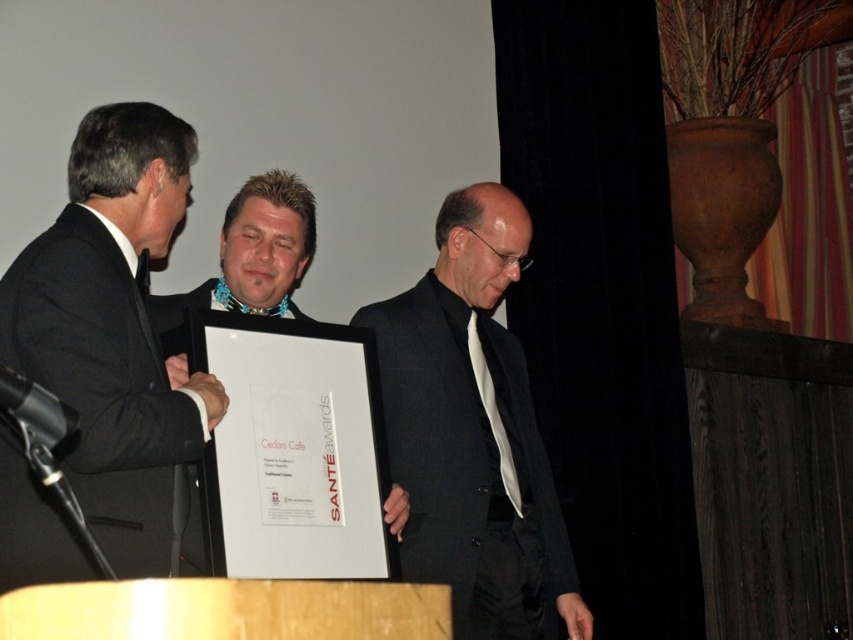
Question: Based on their relative distances, which object is farther from the matte black suit at center?

Choices:
 (A) matte black frame at center
 (B) black suit at left

Answer: (B)

Question: In this image, where is black suit at left located relative to matte black frame at center?

Choices:
 (A) above
 (B) below

Answer: (B)

Question: Which object is positioned farthest from the matte black frame at center?

Choices:
 (A) matte black suit at center
 (B) black suit at left

Answer: (A)

Question: Is matte black suit at center to the right of matte black frame at center from the viewer's perspective?

Choices:
 (A) no
 (B) yes

Answer: (B)

Question: Estimate the real-world distances between objects in this image. Which object is farther from the matte black suit at center?

Choices:
 (A) black suit at left
 (B) matte black frame at center

Answer: (A)

Question: Can you confirm if matte black suit at center is positioned to the right of matte black frame at center?

Choices:
 (A) no
 (B) yes

Answer: (B)